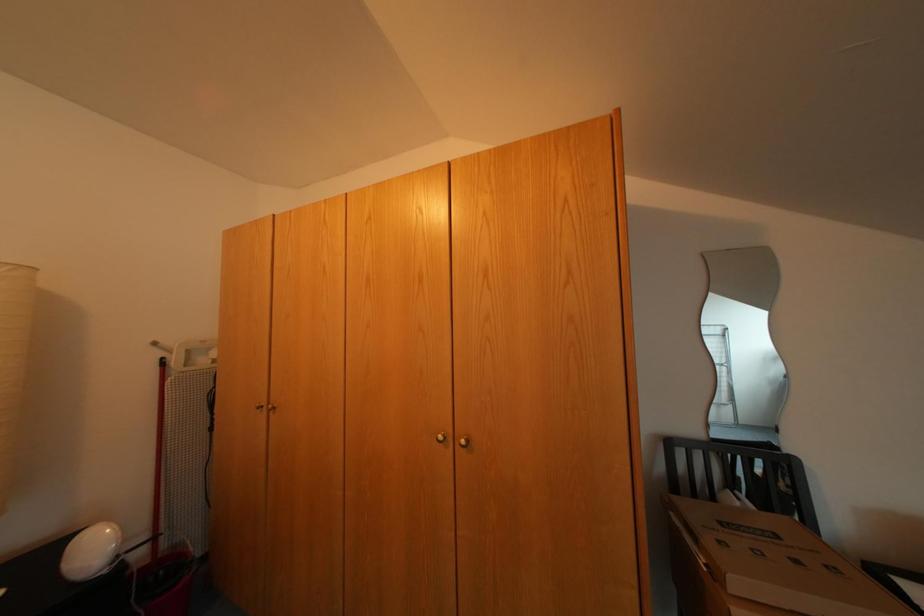
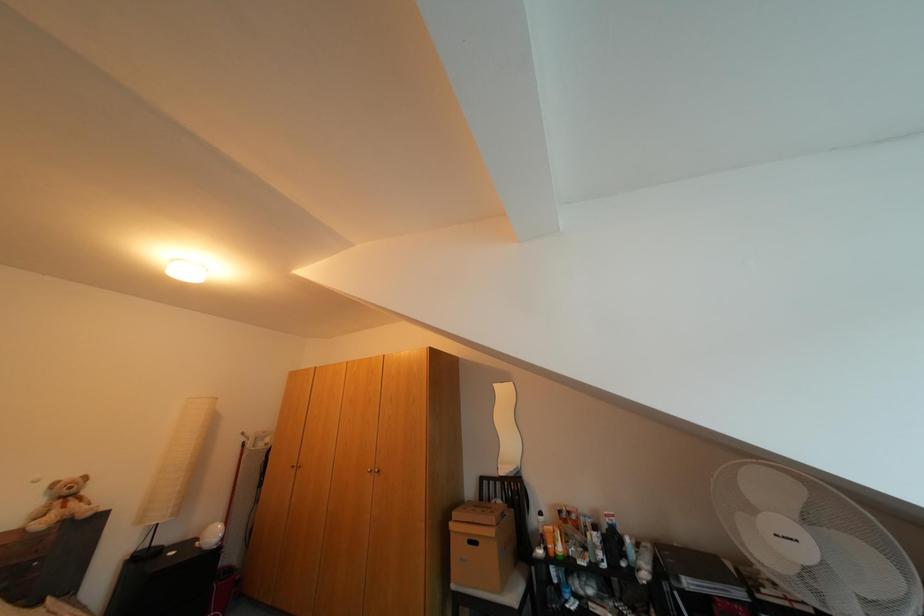
What movement of the cameraman would produce the second image?

The movement direction of the cameraman is right, backward.